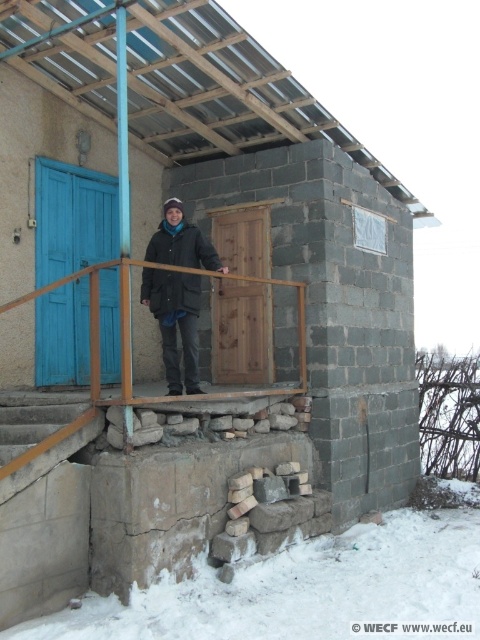
Question: Is wooden door at center thinner than concrete stairs at lower left?

Choices:
 (A) yes
 (B) no

Answer: (A)

Question: Is the position of dark gray woolen coat at center more distant than that of dark green matte jacket at center?

Choices:
 (A) no
 (B) yes

Answer: (A)

Question: Does white powdery snow at lower center lie behind dark gray woolen coat at center?

Choices:
 (A) yes
 (B) no

Answer: (B)

Question: Which object appears farthest from the camera in this image?

Choices:
 (A) dark green matte jacket at center
 (B) blue wooden door at left

Answer: (B)

Question: Which object appears farthest from the camera in this image?

Choices:
 (A) blue wooden door at left
 (B) wooden door at center
 (C) concrete stairs at lower left

Answer: (B)

Question: Among these objects, which one is nearest to the camera?

Choices:
 (A) concrete stairs at lower left
 (B) white powdery snow at lower center

Answer: (B)